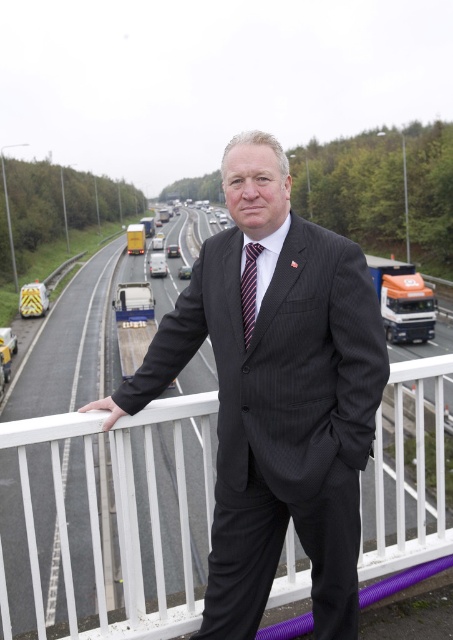
Question: Can you confirm if white metal railing at center is positioned to the right of striped fabric tie at center?

Choices:
 (A) yes
 (B) no

Answer: (B)

Question: Observing the image, what is the correct spatial positioning of white metal railing at center in reference to striped fabric tie at center?

Choices:
 (A) right
 (B) left

Answer: (B)

Question: Is black pinstripe suit at center further to camera compared to white metal railing at center?

Choices:
 (A) yes
 (B) no

Answer: (B)

Question: Which object is positioned closest to the black pinstripe suit at center?

Choices:
 (A) striped fabric tie at center
 (B) white metal railing at center

Answer: (A)

Question: Among these points, which one is farthest from the camera?

Choices:
 (A) (250, 317)
 (B) (236, 275)

Answer: (B)

Question: Which point is farther to the camera?

Choices:
 (A) striped fabric tie at center
 (B) white metal railing at center

Answer: (B)